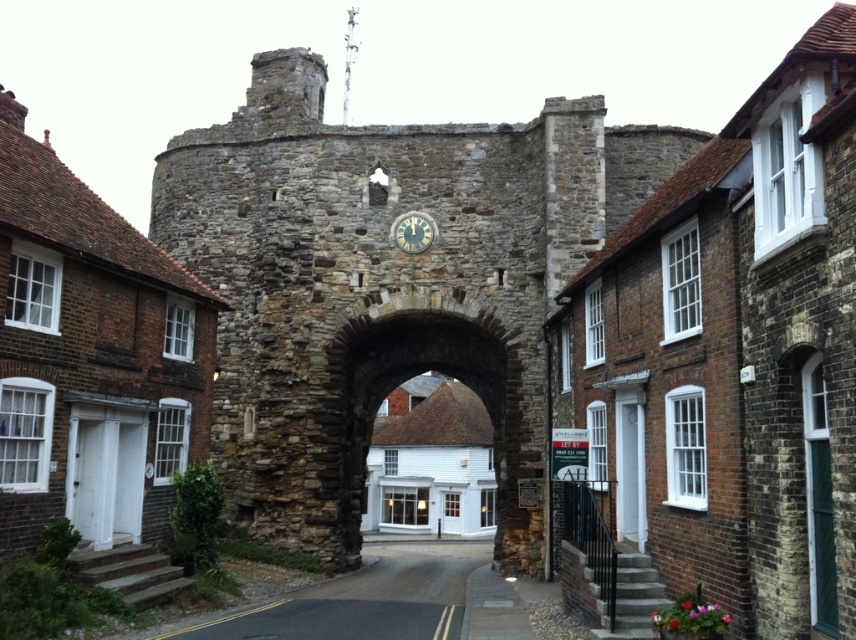
Is point (411, 324) positioned before point (431, 227)?

No, (411, 324) is behind (431, 227).

Between stone archway at center and gold-toned metal clock at center, which one has more height?

stone archway at center

What do you see at coordinates (419, 372) in the screenshot? The image size is (856, 640). I see `stone archway at center` at bounding box center [419, 372].

Locate an element on the screen. The height and width of the screenshot is (640, 856). stone archway at center is located at coordinates tap(419, 372).

Between stone archway at center and smooth asphalt road at center, which one has more height?

stone archway at center

Who is positioned more to the right, stone archway at center or smooth asphalt road at center?

stone archway at center is more to the right.

Who is more forward, (383,394) or (293,627)?

Point (293,627) is more forward.

What are the coordinates of `stone archway at center` in the screenshot? It's located at (419, 372).

From the picture: Can you confirm if smooth asphalt road at center is wider than gold-toned metal clock at center?

Yes, smooth asphalt road at center is wider than gold-toned metal clock at center.

Does smooth asphalt road at center have a greater height compared to gold-toned metal clock at center?

Yes, smooth asphalt road at center is taller than gold-toned metal clock at center.

Is point (298, 637) positioned behind point (414, 250)?

That is False.

I want to click on smooth asphalt road at center, so click(x=364, y=600).